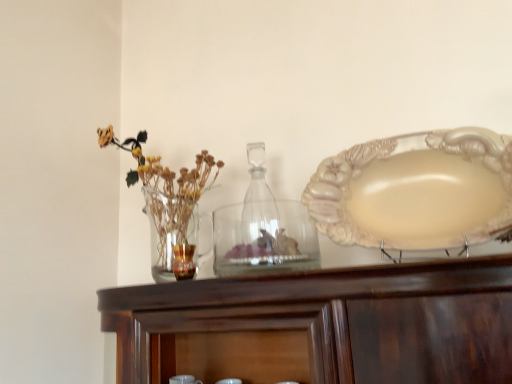
Question: Is translucent glass vase at left directly adjacent to transparent glass bottle at center?

Choices:
 (A) yes
 (B) no

Answer: (B)

Question: Does translucent glass vase at left turn towards transparent glass bottle at center?

Choices:
 (A) no
 (B) yes

Answer: (A)

Question: Is translucent glass vase at left smaller than transparent glass bottle at center?

Choices:
 (A) yes
 (B) no

Answer: (B)

Question: Is translucent glass vase at left at the left side of transparent glass bottle at center?

Choices:
 (A) yes
 (B) no

Answer: (A)

Question: Considering the relative positions of translucent glass vase at left and transparent glass bottle at center in the image provided, is translucent glass vase at left to the right of transparent glass bottle at center from the viewer's perspective?

Choices:
 (A) no
 (B) yes

Answer: (A)

Question: Considering the relative positions of translucent glass vase at left and transparent glass bottle at center in the image provided, is translucent glass vase at left behind transparent glass bottle at center?

Choices:
 (A) no
 (B) yes

Answer: (A)

Question: Does translucent glass candle at center, which is the 2th tableware from right to left, have a lesser height compared to transparent glass bottle at center?

Choices:
 (A) yes
 (B) no

Answer: (A)

Question: Is translucent glass candle at center, which is counted as the first tableware, starting from the left, bigger than transparent glass bottle at center?

Choices:
 (A) no
 (B) yes

Answer: (A)

Question: Does translucent glass candle at center, which is the 2th tableware from right to left, appear on the right side of transparent glass bottle at center?

Choices:
 (A) no
 (B) yes

Answer: (A)

Question: Is translucent glass candle at center, which is counted as the first tableware, starting from the left, directly adjacent to transparent glass bottle at center?

Choices:
 (A) no
 (B) yes

Answer: (A)

Question: Is translucent glass candle at center, which is the 2th tableware from right to left, thinner than transparent glass bottle at center?

Choices:
 (A) no
 (B) yes

Answer: (B)

Question: Would you say translucent glass candle at center, which is the 2th tableware from right to left, is outside transparent glass bottle at center?

Choices:
 (A) no
 (B) yes

Answer: (B)

Question: Is the depth of transparent glass bottle at center less than that of matte cream plate at right?

Choices:
 (A) no
 (B) yes

Answer: (A)